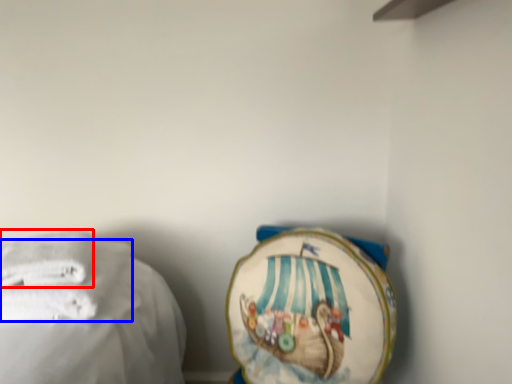
Question: Which object appears closest to the camera in this image, towel (highlighted by a red box) or towel (highlighted by a blue box)?

Choices:
 (A) towel
 (B) towel

Answer: (B)